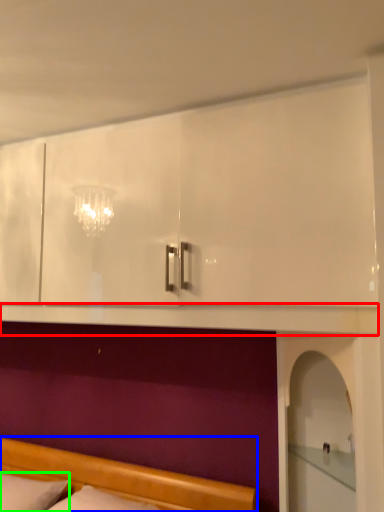
Question: Based on their relative distances, which object is nearer to mantle (highlighted by a red box)? Choose from bed (highlighted by a blue box) and pillow (highlighted by a green box).

Choices:
 (A) bed
 (B) pillow

Answer: (A)